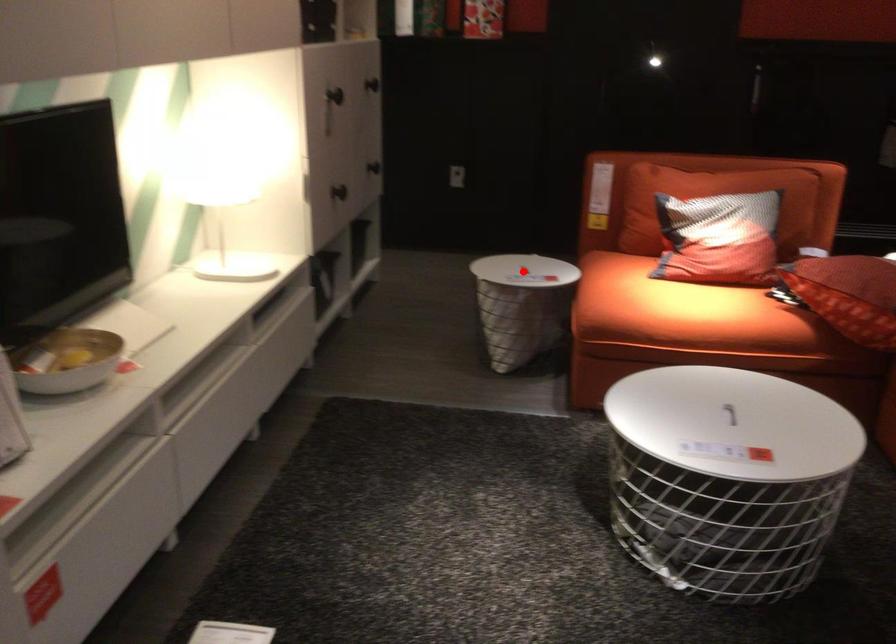
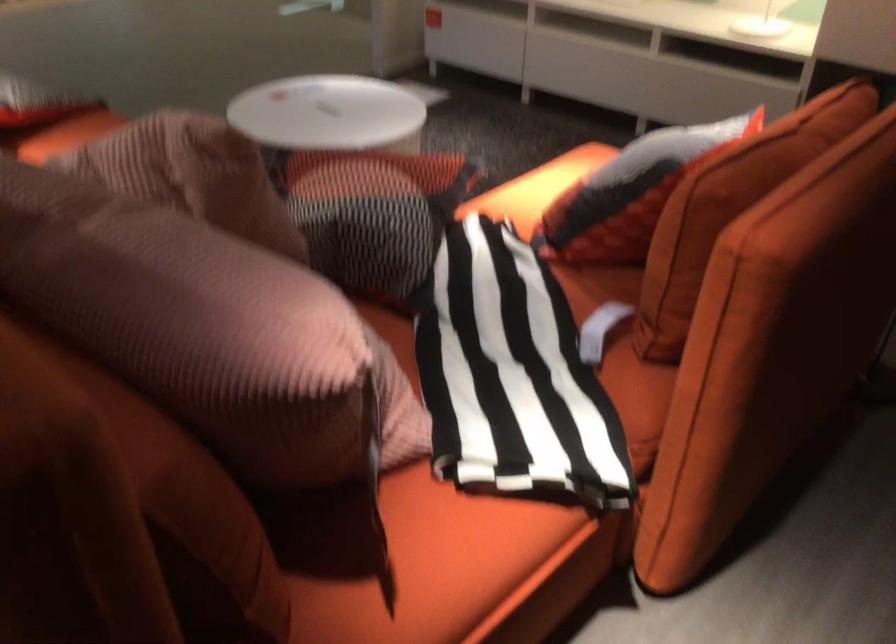
Question: I am providing you with two images of the same scene from different viewpoints. A red point is marked on the first image. Is the red point's position out of view in image 2?

Choices:
 (A) Yes
 (B) No

Answer: (A)